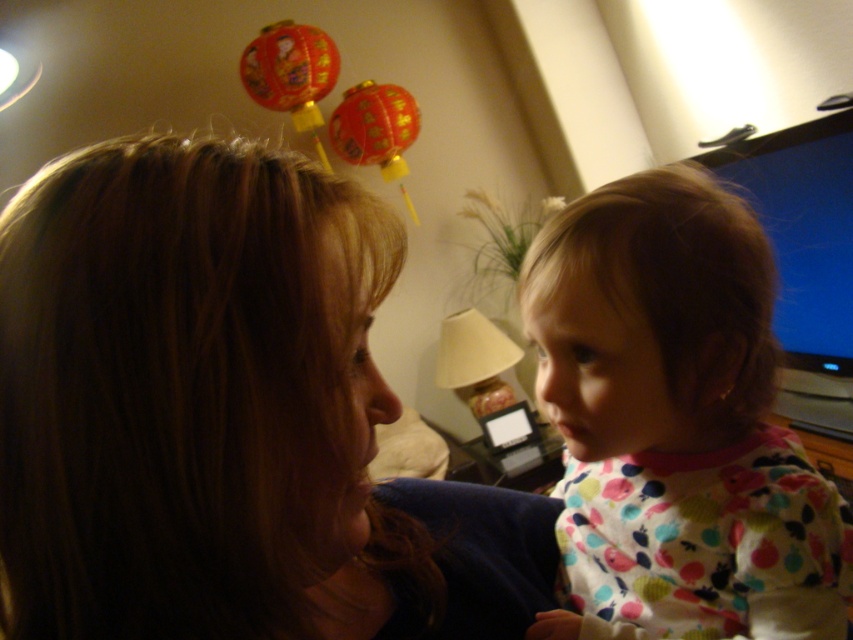
You are a photographer trying to capture a candid shot of the brown hair at upper left and the polka dot pajamas at right. Since you want to focus on both subjects equally, which one should you adjust your camera angle to prioritize? Please explain your reasoning based on their positions.

The brown hair at upper left is positioned under the polka dot pajamas at right. To focus on both subjects equally, you should adjust the camera angle to look slightly upwards to ensure both the brown hair at upper left and the polka dot pajamas at right are in clear view without one blocking the other.

You are a photographer taking a picture of the scene. You notice the brown hair at upper left and the polka dot pajamas at right. Which object should you adjust to ensure both are in focus? Explain your reasoning.

The brown hair at upper left has a lesser height compared to polka dot pajamas at right. To ensure both are in focus, you should adjust the camera focus to account for the difference in height between the two objects. Since the brown hair at upper left is shorter, you might need to focus on the closer object first and ensure the depth of field includes both.